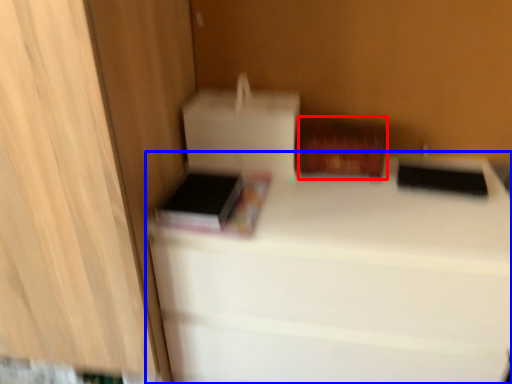
Question: Which of the following is the farthest to the observer, cardboard box (highlighted by a red box) or furniture (highlighted by a blue box)?

Choices:
 (A) cardboard box
 (B) furniture

Answer: (A)